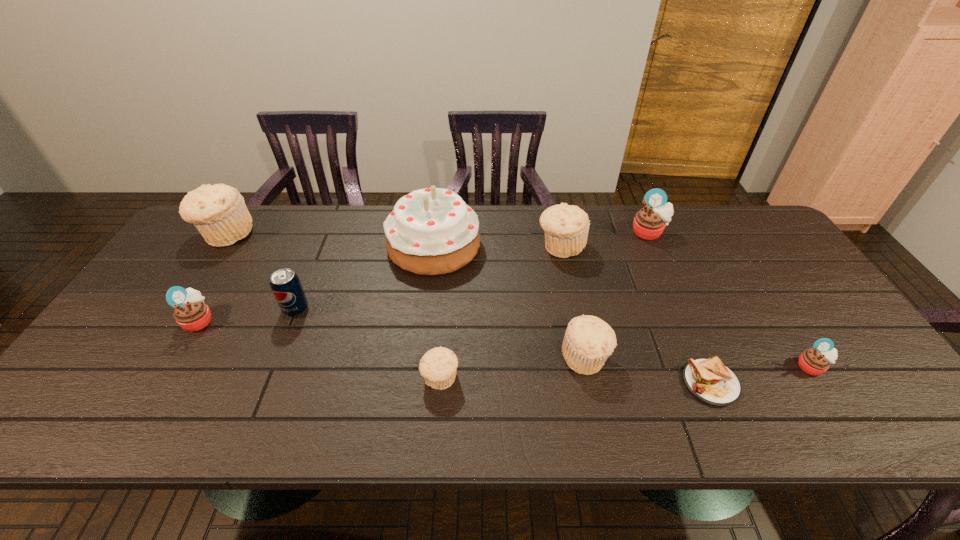
Identify the location of empty location between the cake and the biggest beige muffin. (330, 240).

Locate an element on the screen. The height and width of the screenshot is (540, 960). free space between the leftmost beige muffin and the second nearest pink muffin is located at coordinates (213, 277).

Find the location of `free space between the third biggest beige muffin and the smallest beige muffin`. free space between the third biggest beige muffin and the smallest beige muffin is located at coordinates coord(513,368).

This screenshot has width=960, height=540. What are the coordinates of `vacant point located between the eighth object from right to left and the red cake` in the screenshot? It's located at (365, 278).

You are a GUI agent. You are given a task and a screenshot of the screen. Output one action in this format:
    pyautogui.click(x=<x>, y=<y>)
    Task: Click on the free space between the red cake and the shortest object
    The height and width of the screenshot is (540, 960).
    Given the screenshot: What is the action you would take?
    pyautogui.click(x=572, y=314)

Locate an element on the screen. Image resolution: width=960 pixels, height=540 pixels. object that is the second closest to the red cake is located at coordinates (285, 284).

Locate an element on the screen. object that stands as the third closest to the second smallest beige muffin is located at coordinates (566, 227).

Locate an element on the screen. muffin that stands as the closest to the nearest pink muffin is located at coordinates (588, 342).

The height and width of the screenshot is (540, 960). I want to click on muffin that is the fifth closest to the soda can, so click(588, 342).

Locate which beige muffin is the third closest to the leftmost beige muffin. Please provide its 2D coordinates. Your answer should be formatted as a tuple, i.e. [(x, y)], where the tuple contains the x and y coordinates of a point satisfying the conditions above.

[(588, 342)]